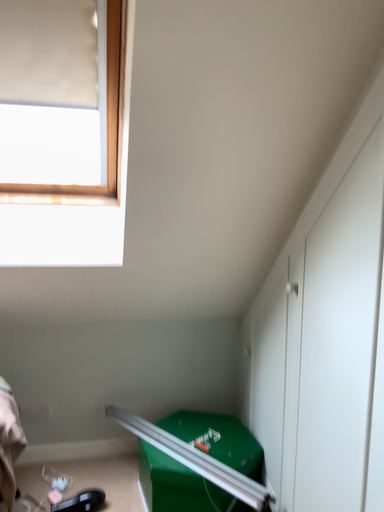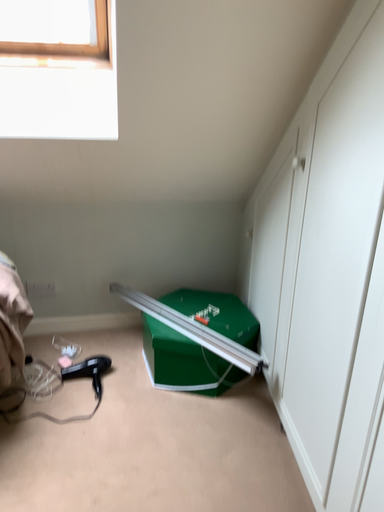
Question: How did the camera likely rotate when shooting the video?

Choices:
 (A) rotated downward
 (B) rotated upward

Answer: (A)